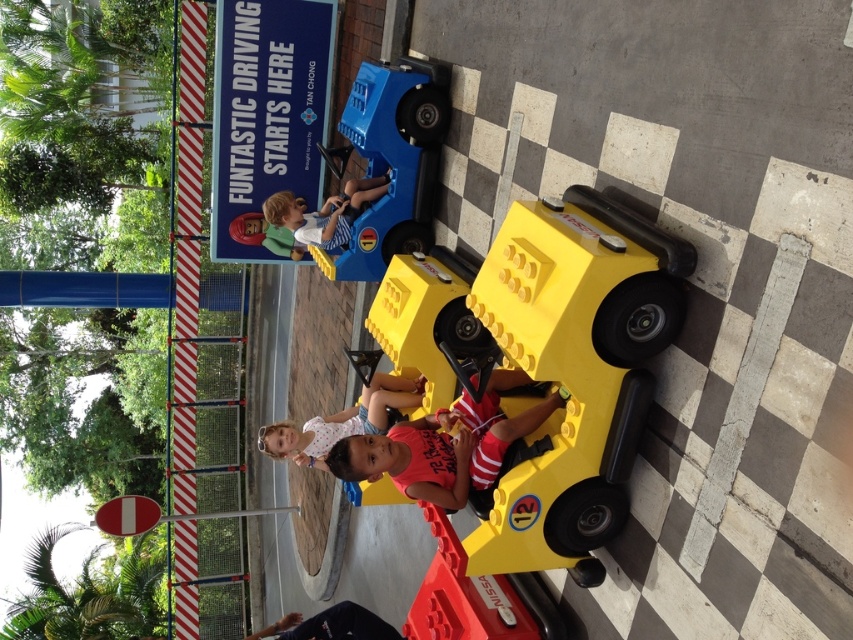
Question: Is matte pink shirt at center thinner than matte blue shirt at center?

Choices:
 (A) yes
 (B) no

Answer: (B)

Question: Which point is farther to the camera?

Choices:
 (A) (349, 182)
 (B) (346, 634)
 (C) (555, 540)
 (D) (373, 426)

Answer: (A)

Question: Does yellow plastic toy car at center have a smaller size compared to matte blue shirt at center?

Choices:
 (A) no
 (B) yes

Answer: (A)

Question: Is matte blue shirt at center closer to the viewer compared to dark blue jeans at lower center?

Choices:
 (A) no
 (B) yes

Answer: (A)

Question: Which object appears closest to the camera in this image?

Choices:
 (A) yellow plastic toy car at center
 (B) matte blue shirt at center
 (C) dark blue jeans at lower center
 (D) matte pink shirt at center

Answer: (A)

Question: Which object appears closest to the camera in this image?

Choices:
 (A) matte blue shirt at center
 (B) dark blue jeans at lower center
 (C) yellow plastic toy car at center

Answer: (C)